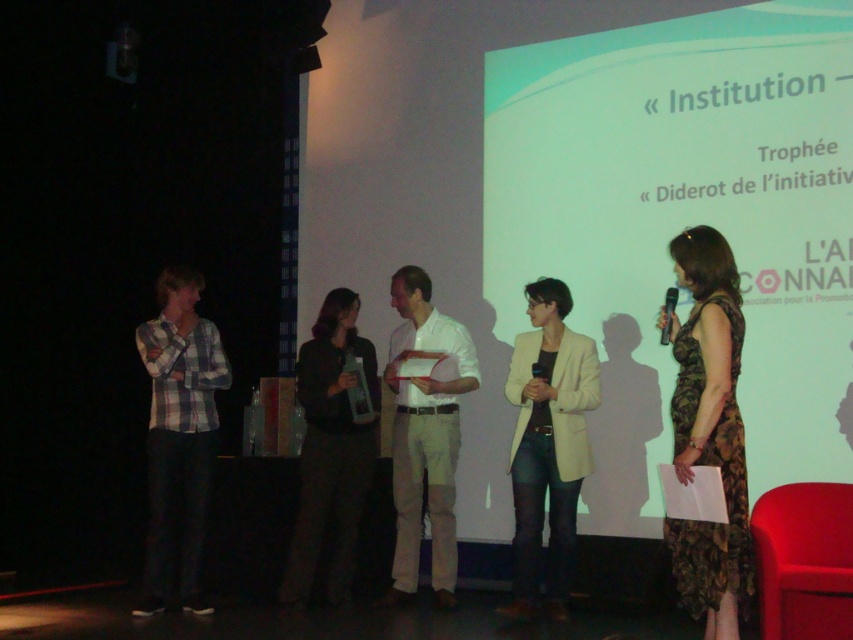
Question: Considering the relative positions of matte beige blazer at center and white matte shirt at center in the image provided, where is matte beige blazer at center located with respect to white matte shirt at center?

Choices:
 (A) below
 (B) above

Answer: (A)

Question: Based on their relative distances, which object is nearer to the white glossy projection screen at upper center?

Choices:
 (A) plaid cotton shirt at left
 (B) matte beige blazer at center
 (C) white matte shirt at center

Answer: (B)

Question: From the image, what is the correct spatial relationship of matte beige blazer at center in relation to white matte shirt at center?

Choices:
 (A) left
 (B) right

Answer: (B)

Question: Among these points, which one is nearest to the camera?

Choices:
 (A) (512, 440)
 (B) (693, 301)
 (C) (436, 381)
 (D) (167, 470)

Answer: (B)

Question: Which point is farther to the camera?

Choices:
 (A) (434, 396)
 (B) (373, 390)

Answer: (B)

Question: Is matte beige blazer at center thinner than white matte shirt at center?

Choices:
 (A) no
 (B) yes

Answer: (B)